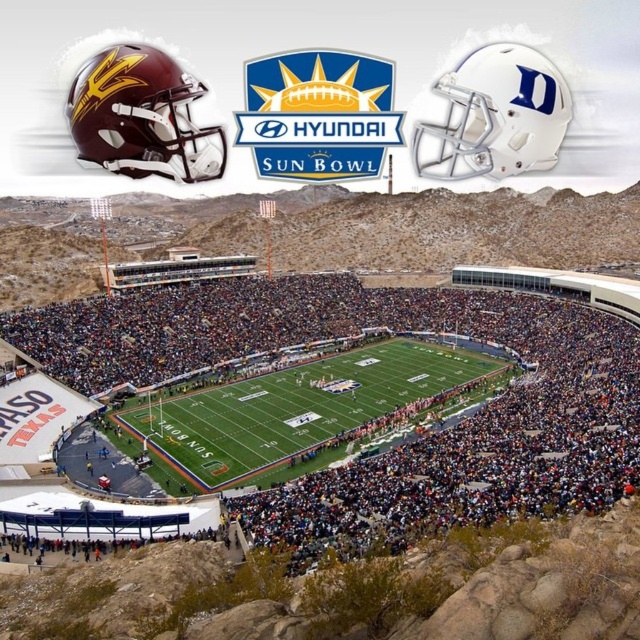
You are a photographer taking a picture of the Hyundai Sun Bowl stadium. You notice the matte green turf at center and the green turf football field at center. Which one appears bigger in your photo?

The matte green turf at center appears bigger in the photo because it is larger in size than the green turf football field at center.

You are a sports equipment manager at the Hyundai Sun Bowl. You need to store the white matte helmet at upper right and the maroon matte helmet at upper left in a narrow locker that can only accommodate helmets with a maximum thickness of 10 cm. Which helmet should you place first to ensure both fit?

The white matte helmet at upper right is thinner than the maroon matte helmet at upper left. Since the locker has a maximum thickness of 10 cm, you should place the maroon matte helmet at upper left first, then the white matte helmet at upper right, provided the total thickness does not exceed the limit.